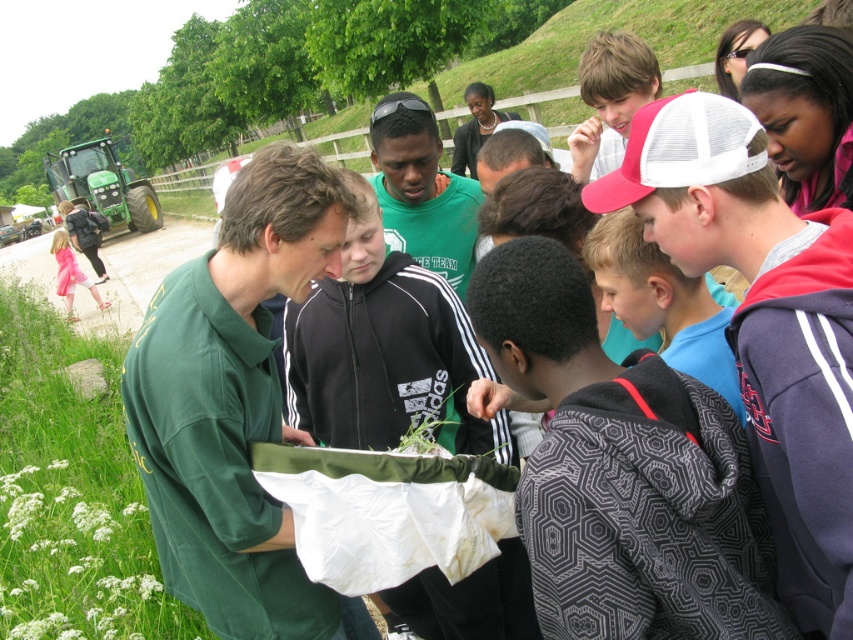
You are part of the group observing the scene. There are two items of interest here, the blue cotton shirt at center and the green leafy vegetable at center. Which one is positioned more to the left?

The green leafy vegetable at center is positioned more to the left since the blue cotton shirt at center is to the right of it.

You are part of the group observing the plant in the white plastic bag. You notice two people in the center wearing shirts labeled as blue cotton shirt at center and green matte shirt at center. Which person is closer to the ground?

The blue cotton shirt at center is shorter than the green matte shirt at center, so the person wearing the blue cotton shirt at center is closer to the ground.

You are a photographer trying to capture a group photo of the blue cotton shirt at center and the green matte shirt at center. Your camera has a minimum focus distance of 1.2 meters. Will you be able to take the photo without moving either of them?

The distance between the blue cotton shirt at center and the green matte shirt at center is 1.11 meters, which is less than the camera minimum focus distance of 1.2 meters. Therefore, you cannot take the photo without moving them closer or further apart.